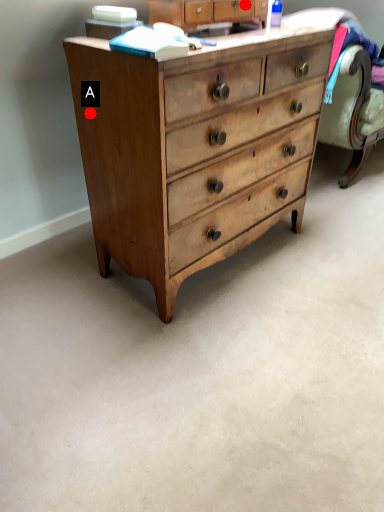
Question: Two points are circled on the image, labeled by A and B beside each circle. Which point appears closest to the camera in this image?

Choices:
 (A) A is closer
 (B) B is closer

Answer: (A)